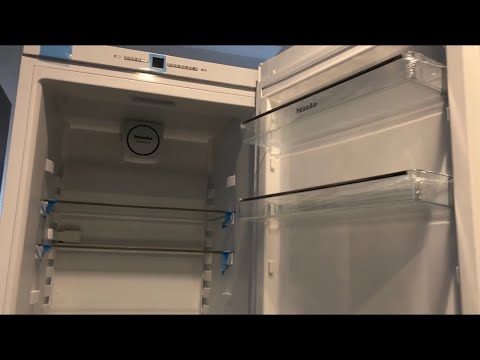
Identify the location of shelves. (121, 248), (98, 206).